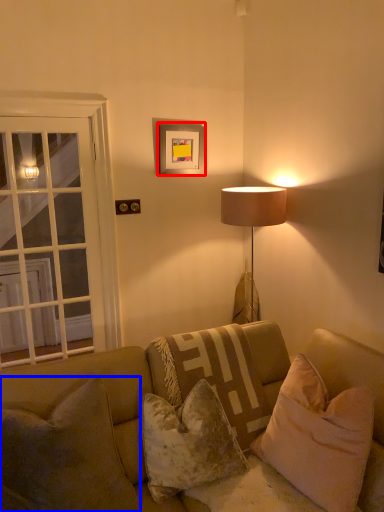
Question: Among these objects, which one is nearest to the camera, picture frame (highlighted by a red box) or pillow (highlighted by a blue box)?

Choices:
 (A) picture frame
 (B) pillow

Answer: (B)